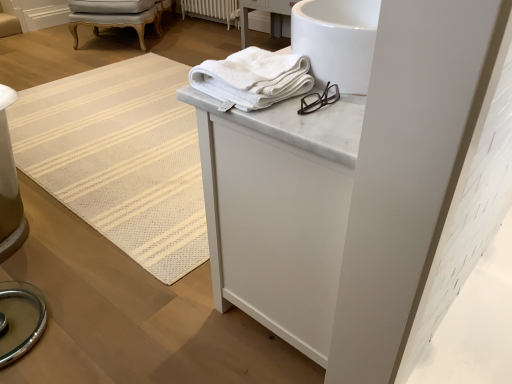
Question: Can you confirm if white marble cabinet at upper center is taller than white painted radiator at center?

Choices:
 (A) yes
 (B) no

Answer: (A)

Question: Is white marble cabinet at upper center shorter than white painted radiator at center?

Choices:
 (A) yes
 (B) no

Answer: (B)

Question: Does white marble cabinet at upper center appear on the left side of white painted radiator at center?

Choices:
 (A) no
 (B) yes

Answer: (A)

Question: Considering the relative sizes of white marble cabinet at upper center and white painted radiator at center in the image provided, is white marble cabinet at upper center smaller than white painted radiator at center?

Choices:
 (A) no
 (B) yes

Answer: (A)

Question: Is white marble cabinet at upper center bigger than white painted radiator at center?

Choices:
 (A) no
 (B) yes

Answer: (B)

Question: Is white cotton towel at upper center bigger or smaller than light gray upholstered chair at upper left?

Choices:
 (A) small
 (B) big

Answer: (A)

Question: From a real-world perspective, is white cotton towel at upper center positioned above or below light gray upholstered chair at upper left?

Choices:
 (A) above
 (B) below

Answer: (A)

Question: In terms of width, does white cotton towel at upper center look wider or thinner when compared to light gray upholstered chair at upper left?

Choices:
 (A) thin
 (B) wide

Answer: (A)

Question: Does point (244, 59) appear closer or farther from the camera than point (92, 18)?

Choices:
 (A) closer
 (B) farther

Answer: (A)

Question: Considering the positions of white textured mat at upper center and white marble cabinet at upper center in the image, is white textured mat at upper center taller or shorter than white marble cabinet at upper center?

Choices:
 (A) short
 (B) tall

Answer: (A)

Question: From a real-world perspective, relative to white marble cabinet at upper center, is white textured mat at upper center vertically above or below?

Choices:
 (A) above
 (B) below

Answer: (B)

Question: Is white textured mat at upper center bigger or smaller than white marble cabinet at upper center?

Choices:
 (A) small
 (B) big

Answer: (A)

Question: From the image's perspective, is white textured mat at upper center positioned above or below white marble cabinet at upper center?

Choices:
 (A) above
 (B) below

Answer: (A)

Question: Considering the positions of point (159, 8) and point (293, 269), is point (159, 8) closer or farther from the camera than point (293, 269)?

Choices:
 (A) closer
 (B) farther

Answer: (B)

Question: Choose the correct answer: Is light gray upholstered chair at upper left inside white marble cabinet at upper center or outside it?

Choices:
 (A) inside
 (B) outside

Answer: (B)